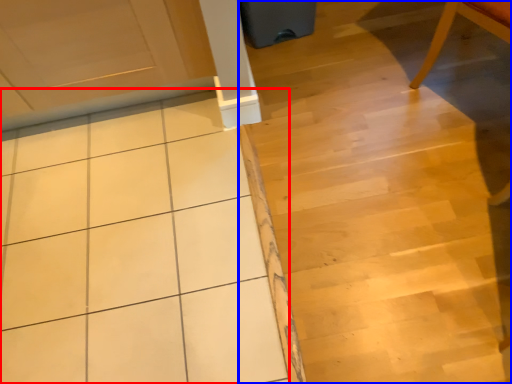
Question: Which point is further to the camera, ceramic tile (highlighted by a red box) or stair (highlighted by a blue box)?

Choices:
 (A) ceramic tile
 (B) stair

Answer: (A)